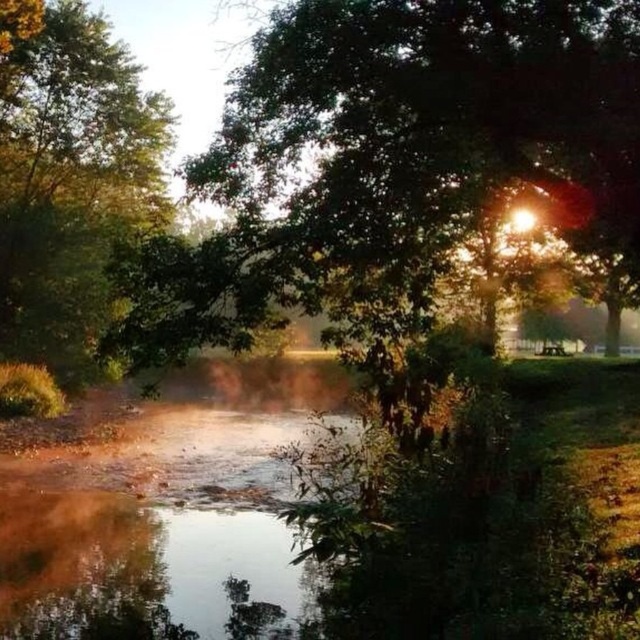
You are standing at the edge of the water and want to take a photo of the green leafy tree at center. If your camera has a focal length of 50mm and you want to capture the tree in full without moving closer, what is the minimum focal length you need to use?

The green leafy tree at center is 5.61 meters away. To capture it fully without moving closer, you would need a focal length shorter than 50mm. However, since the question asks for the minimum focal length required, you might need to adjust based on the tree height and sensor size. Without specific dimensions, it is hard to calculate precisely, but using a wider angle lens than 50mm would help include the entire tree in the frame.

You are standing in the serene natural scene and want to walk from the green leafy tree at left to the green leafy tree at center. Which direction should you face to walk directly towards your destination?

You should face to the right to walk directly towards the green leafy tree at center from the green leafy tree at left, since the green leafy tree at center is positioned on the right side of green leafy tree at left.